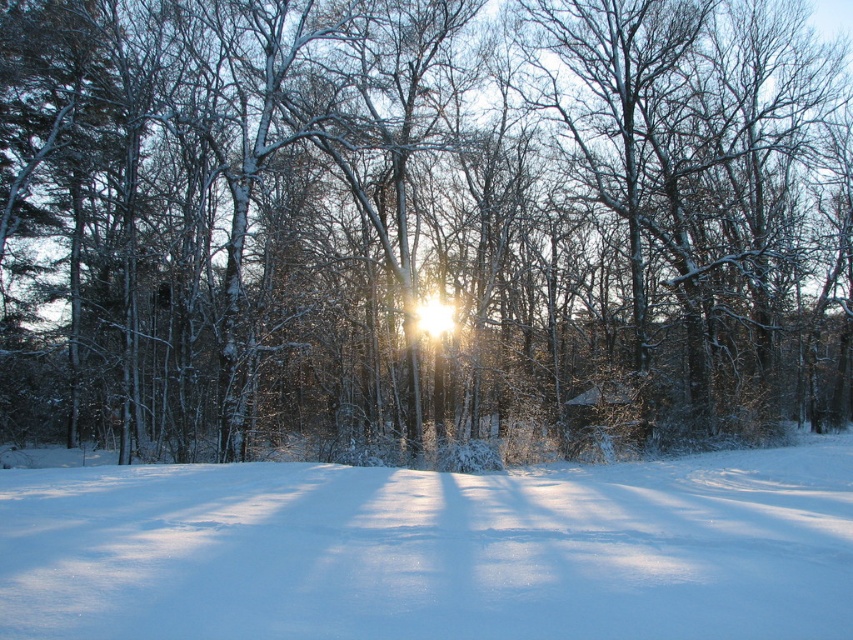
Question: Which point is farther to the camera?

Choices:
 (A) (604, 4)
 (B) (51, 544)

Answer: (A)

Question: Is white snow-covered tree at center smaller than white fluffy snow at center?

Choices:
 (A) no
 (B) yes

Answer: (A)

Question: Can you confirm if white snow-covered tree at center is thinner than white fluffy snow at center?

Choices:
 (A) no
 (B) yes

Answer: (A)

Question: Observing the image, what is the correct spatial positioning of white snow-covered tree at center in reference to white fluffy snow at center?

Choices:
 (A) above
 (B) below

Answer: (A)

Question: Among these points, which one is nearest to the camera?

Choices:
 (A) (410, 266)
 (B) (321, 593)

Answer: (B)